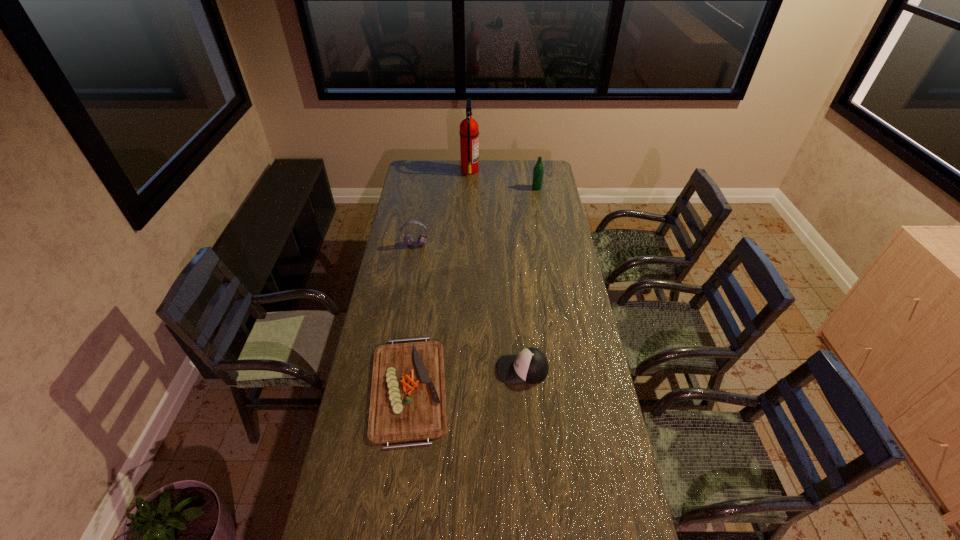
Identify the location of free spot between the chopping board and the rightmost object. (472, 288).

Locate an element on the screen. This screenshot has width=960, height=540. free area in between the shortest object and the second shortest object is located at coordinates (466, 379).

Where is `vacant space in between the bottle and the farthest object`? The height and width of the screenshot is (540, 960). vacant space in between the bottle and the farthest object is located at coordinates (503, 179).

Locate an element on the screen. This screenshot has width=960, height=540. vacant point located between the cap and the farthest object is located at coordinates (496, 269).

The height and width of the screenshot is (540, 960). Identify the location of object that stands as the third closest to the shortest object. (538, 171).

In order to click on object that is the closest to the tallest object in this screenshot , I will do [x=538, y=171].

Locate an element on the screen. vacant space that satisfies the following two spatial constraints: 1. on the back side of the second tallest object; 2. on the side of the fire extinguisher near the handle is located at coordinates (534, 170).

Find the location of a particular element. free location that satisfies the following two spatial constraints: 1. on the side of the fire extinguisher near the handle; 2. on the headband and ear cups of the third shortest object is located at coordinates (468, 245).

Locate an element on the screen. This screenshot has height=540, width=960. free location that satisfies the following two spatial constraints: 1. on the front panel of the second shortest object; 2. on the front side of the chopping board is located at coordinates (524, 388).

Where is `free space that satisfies the following two spatial constraints: 1. on the side of the second farthest object near the handle; 2. on the left side of the fire extinguisher`? free space that satisfies the following two spatial constraints: 1. on the side of the second farthest object near the handle; 2. on the left side of the fire extinguisher is located at coordinates (469, 188).